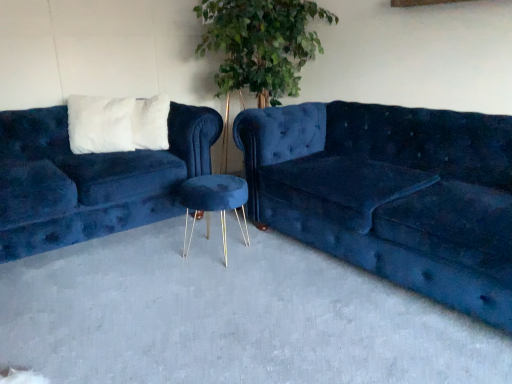
Question: Considering the relative positions of blue velvet stool at center and velvet blue stool at center in the image provided, is blue velvet stool at center to the left or to the right of velvet blue stool at center?

Choices:
 (A) left
 (B) right

Answer: (B)

Question: Choose the correct answer: Is blue velvet stool at center inside velvet blue stool at center or outside it?

Choices:
 (A) inside
 (B) outside

Answer: (B)

Question: Considering the real-world distances, which object is closest to the velvet blue couch at center, which ranks as the 1th studio couch in right-to-left order?

Choices:
 (A) velvet blue couch at left, which ranks as the first studio couch in left-to-right order
 (B) blue velvet stool at center
 (C) velvet blue stool at center

Answer: (B)

Question: Estimate the real-world distances between objects in this image. Which object is closer to the velvet blue couch at center, which ranks as the 1th studio couch in right-to-left order?

Choices:
 (A) blue velvet stool at center
 (B) velvet blue stool at center
 (C) velvet blue couch at left, marked as the 2th studio couch in a right-to-left arrangement

Answer: (A)